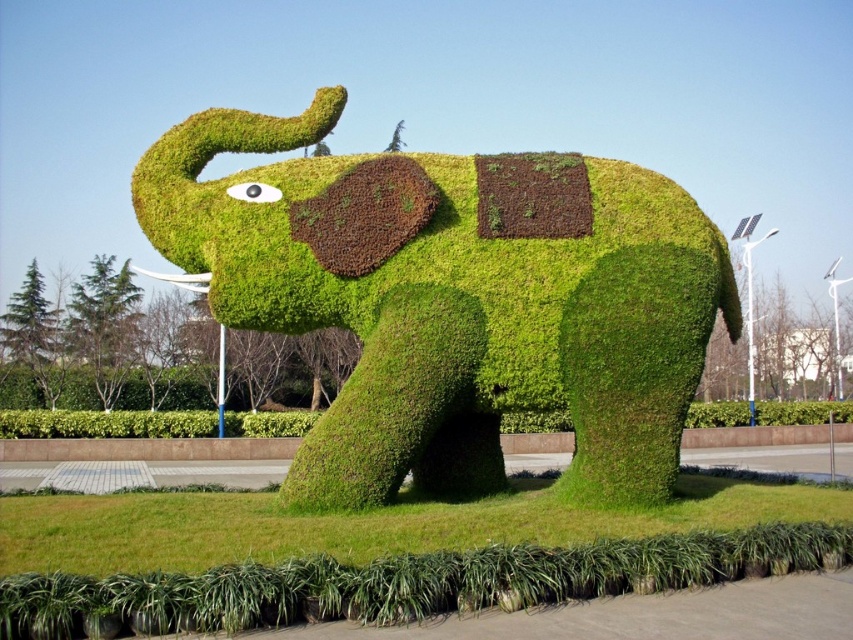
Between green grassy elephant at center and green grass at lower center, which one has more height?

green grassy elephant at center is taller.

What are the coordinates of `green grassy elephant at center` in the screenshot? It's located at point(453,298).

Which is in front, point (451, 369) or point (158, 516)?

Point (158, 516) is in front.

Where is `green grassy elephant at center`? This screenshot has width=853, height=640. green grassy elephant at center is located at coordinates (453, 298).